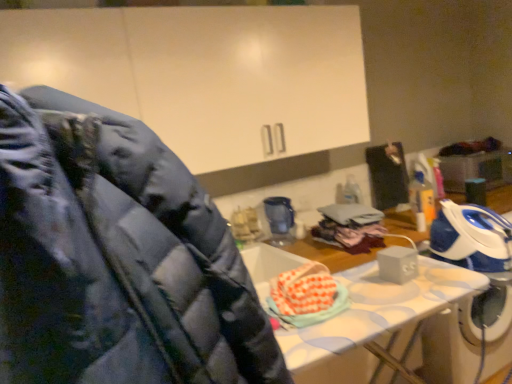
Question: Considering the relative positions of black fabric suit at upper right and blue plastic blender at center in the image provided, is black fabric suit at upper right behind blue plastic blender at center?

Choices:
 (A) no
 (B) yes

Answer: (B)

Question: Does black fabric suit at upper right have a lesser height compared to blue plastic blender at center?

Choices:
 (A) no
 (B) yes

Answer: (A)

Question: Is black fabric suit at upper right located outside blue plastic blender at center?

Choices:
 (A) yes
 (B) no

Answer: (A)

Question: From the image's perspective, is black fabric suit at upper right under blue plastic blender at center?

Choices:
 (A) no
 (B) yes

Answer: (A)

Question: Is black fabric suit at upper right looking in the opposite direction of blue plastic blender at center?

Choices:
 (A) yes
 (B) no

Answer: (B)

Question: Is black fabric suit at upper right surrounding blue plastic blender at center?

Choices:
 (A) no
 (B) yes

Answer: (A)

Question: From the image's perspective, is blue plastic blender at center under black fabric suit at upper right?

Choices:
 (A) yes
 (B) no

Answer: (A)

Question: Is blue plastic blender at center shorter than black fabric suit at upper right?

Choices:
 (A) no
 (B) yes

Answer: (B)

Question: Is black fabric suit at upper right at the back of blue plastic blender at center?

Choices:
 (A) no
 (B) yes

Answer: (A)

Question: Is black fabric suit at upper right completely or partially inside blue plastic blender at center?

Choices:
 (A) no
 (B) yes

Answer: (A)

Question: From a real-world perspective, is blue plastic blender at center positioned over black fabric suit at upper right based on gravity?

Choices:
 (A) no
 (B) yes

Answer: (A)

Question: Is blue plastic blender at center to the right of black fabric suit at upper right from the viewer's perspective?

Choices:
 (A) no
 (B) yes

Answer: (A)

Question: Visually, is black fabric suit at upper right positioned to the left or to the right of blue plastic blender at center?

Choices:
 (A) left
 (B) right

Answer: (B)